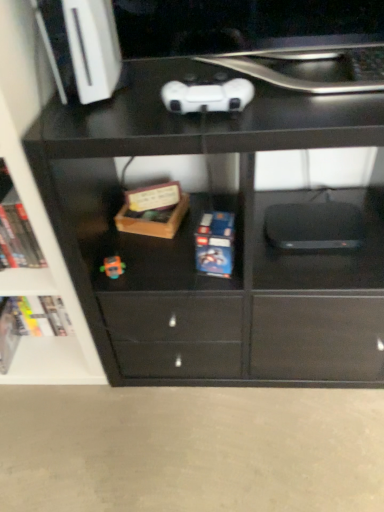
Locate an element on the screen. vacant space to the left of white matte game controller at upper center is located at coordinates (118, 114).